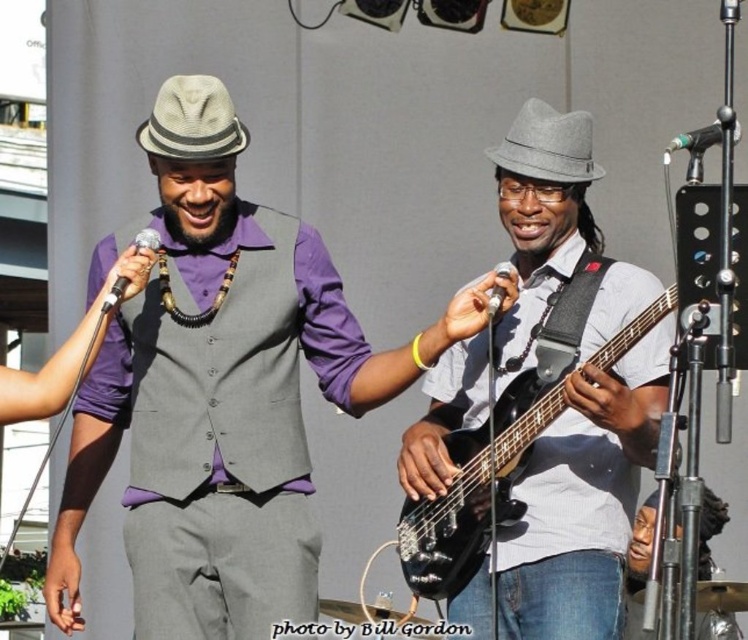
Question: Which of the following is the farthest from the observer?

Choices:
 (A) (616, 545)
 (B) (420, 360)
 (C) (117, 291)
 (D) (496, 301)

Answer: (B)

Question: Where is matte black bass guitar at center located in relation to metallic silver microphone at center in the image?

Choices:
 (A) left
 (B) right

Answer: (B)

Question: Where is matte gray vest at center located in relation to matte silver microphone at upper left in the image?

Choices:
 (A) above
 (B) below

Answer: (B)

Question: Which point is farther from the camera taking this photo?

Choices:
 (A) (462, 298)
 (B) (156, 237)
 (C) (417, 349)

Answer: (C)

Question: Is matte silver microphone at upper left bigger than metallic silver microphone at center?

Choices:
 (A) yes
 (B) no

Answer: (B)

Question: Estimate the real-world distances between objects in this image. Which object is farther from the matte gray vest at center?

Choices:
 (A) yellow rubber bracelet at center
 (B) matte black bass guitar at center
 (C) metallic silver microphone at upper right

Answer: (C)